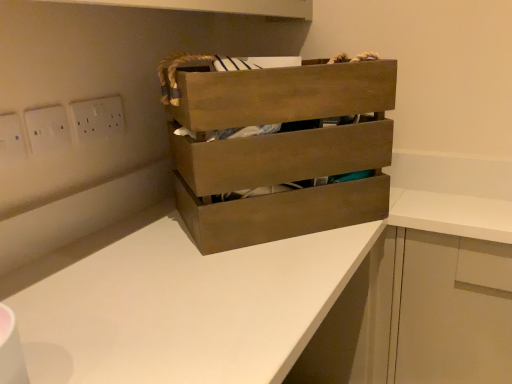
Where is `vacant area that is in front of wooden crate at center`? Image resolution: width=512 pixels, height=384 pixels. vacant area that is in front of wooden crate at center is located at coordinates (232, 281).